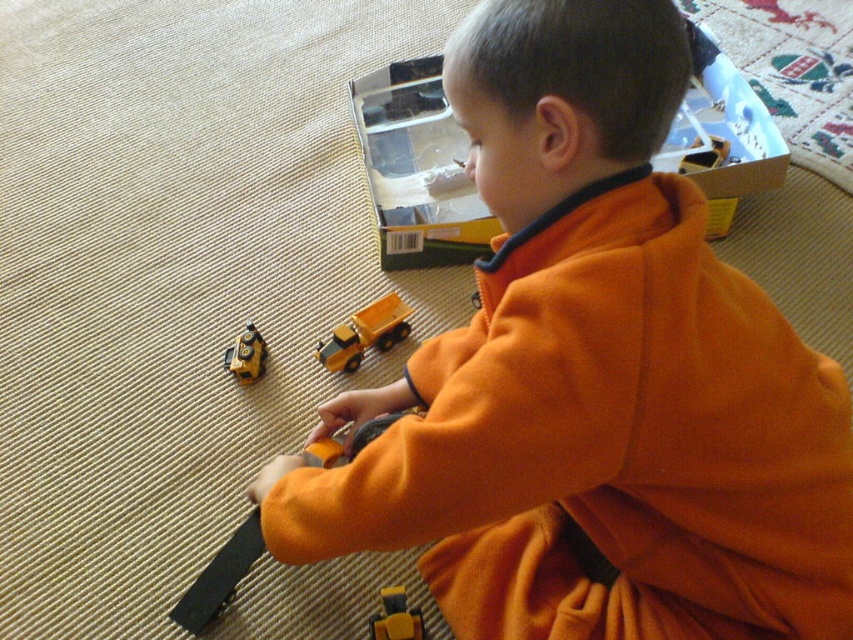
Is yellow matte dump truck at center smaller than metallic yellow truck at lower left?

Incorrect, yellow matte dump truck at center is not smaller in size than metallic yellow truck at lower left.

Where is `yellow matte dump truck at center`? The width and height of the screenshot is (853, 640). yellow matte dump truck at center is located at coordinates (364, 333).

Which of these two, yellow matte dump truck at center or yellow matte toy truck at lower center, stands shorter?

yellow matte toy truck at lower center is shorter.

This screenshot has height=640, width=853. What are the coordinates of `yellow matte dump truck at center` in the screenshot? It's located at (364, 333).

Identify the location of yellow matte dump truck at center. (364, 333).

Is orange fleece jacket at center behind yellow matte dump truck at center?

That is False.

Find the location of a particular element. This screenshot has width=853, height=640. orange fleece jacket at center is located at coordinates (593, 378).

This screenshot has height=640, width=853. Find the location of `orange fleece jacket at center`. orange fleece jacket at center is located at coordinates (593, 378).

Where is `orange fleece jacket at center`? The width and height of the screenshot is (853, 640). orange fleece jacket at center is located at coordinates (593, 378).